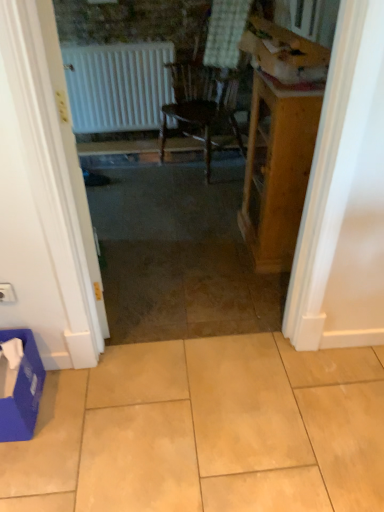
I want to click on white matte radiator at upper left, so click(118, 86).

The image size is (384, 512). What do you see at coordinates (44, 197) in the screenshot?
I see `white matte door at left` at bounding box center [44, 197].

Measure the distance between point (246, 219) and camera.

Point (246, 219) and camera are 2.53 meters apart from each other.

The height and width of the screenshot is (512, 384). What do you see at coordinates (284, 52) in the screenshot?
I see `cardboard box at upper right, the second cardboard box viewed from the left` at bounding box center [284, 52].

The width and height of the screenshot is (384, 512). Identify the location of white plastic electric outlet at lower left. (7, 293).

Can you confirm if white matte radiator at upper left is smaller than beige ceramic tile at center?

Result: Correct, white matte radiator at upper left occupies less space than beige ceramic tile at center.

Can you see white matte radiator at upper left touching beige ceramic tile at center?

white matte radiator at upper left and beige ceramic tile at center are clearly separated.

Based on the photo, does white matte radiator at upper left turn towards beige ceramic tile at center?

Yes, white matte radiator at upper left is facing beige ceramic tile at center.

This screenshot has width=384, height=512. Find the location of `ceramic tile on the right of the white matte radiator at upper left`. ceramic tile on the right of the white matte radiator at upper left is located at coordinates (206, 430).

Which is correct: white matte radiator at upper left is inside white matte door at left, or outside of it?

white matte radiator at upper left cannot be found inside white matte door at left.

From the image's perspective, which is below, white matte radiator at upper left or white matte door at left?

white matte door at left is shown below in the image.

Measure the distance from white matte radiator at upper left to white matte door at left.

white matte radiator at upper left and white matte door at left are 1.95 meters apart.

Considering the relative sizes of white matte radiator at upper left and white matte door at left in the image provided, is white matte radiator at upper left taller than white matte door at left?

No, white matte radiator at upper left is not taller than white matte door at left.

Where is `door that appears in front of the wooden table at right`? The height and width of the screenshot is (512, 384). door that appears in front of the wooden table at right is located at coordinates (44, 197).

Could you tell me if white matte door at left is facing wooden table at right?

Yes.

In the scene shown: Who is bigger, white matte door at left or wooden table at right?

With larger size is wooden table at right.

In the scene shown: Are white matte radiator at upper left and blue cardboard box at lower left, which ranks as the second cardboard box in right-to-left order, located far from each other?

white matte radiator at upper left is far away from blue cardboard box at lower left, which ranks as the second cardboard box in right-to-left order.

In the scene shown: From a real-world perspective, who is located higher, white matte radiator at upper left or blue cardboard box at lower left, which appears as the 1th cardboard box when viewed from the left?

white matte radiator at upper left.

In the image, is white matte radiator at upper left on the left side or the right side of blue cardboard box at lower left, which is counted as the first cardboard box, starting from the bottom?

From the image, it's evident that white matte radiator at upper left is to the right of blue cardboard box at lower left, which is counted as the first cardboard box, starting from the bottom.

Measure the distance from white matte radiator at upper left to blue cardboard box at lower left, which appears as the 1th cardboard box when viewed from the left.

The distance of white matte radiator at upper left from blue cardboard box at lower left, which appears as the 1th cardboard box when viewed from the left, is 2.30 meters.

Between wooden table at right and white matte door at left, which one has less height?

wooden table at right is shorter.

From a real-world perspective, between wooden table at right and white matte door at left, who is vertically higher?

white matte door at left is physically above.

Looking at this image, from the image's perspective, relative to white matte door at left, is wooden table at right above or below?

wooden table at right is situated higher than white matte door at left in the image.

Which object is closer to the camera, wooden table at right or white matte door at left?

white matte door at left is in front.

Can you confirm if white plastic electric outlet at lower left is thinner than white matte radiator at upper left?

Correct, the width of white plastic electric outlet at lower left is less than that of white matte radiator at upper left.

What are the coordinates of `electric outlet lying on the left of white matte radiator at upper left` in the screenshot? It's located at (7, 293).

Does point (1, 298) come behind point (117, 48)?

No, (1, 298) is closer to viewer.

Which object is closer to the camera taking this photo, white plastic electric outlet at lower left or white matte radiator at upper left?

white plastic electric outlet at lower left.

Who is more distant, beige ceramic tile at center or cardboard box at upper right, the second cardboard box viewed from the left?

cardboard box at upper right, the second cardboard box viewed from the left, is further from the camera.

Starting from the beige ceramic tile at center, which cardboard box is the 2nd one behind? Please provide its 2D coordinates.

[(284, 52)]

Can you confirm if beige ceramic tile at center is positioned to the left of cardboard box at upper right, the second cardboard box ordered from the bottom?

Correct, you'll find beige ceramic tile at center to the left of cardboard box at upper right, the second cardboard box ordered from the bottom.

The image size is (384, 512). I want to click on ceramic tile below the white matte radiator at upper left (from a real-world perspective), so click(x=206, y=430).

At what (x,y) coordinates should I click in order to perform the action: click on radiator above the white matte door at left (from the image's perspective). Please return your answer as a coordinate pair (x, y). This screenshot has width=384, height=512. Looking at the image, I should click on (118, 86).

Based on their spatial positions, is white plastic electric outlet at lower left or beige ceramic tile at center further from blue cardboard box at lower left, which is the 2th cardboard box in top-to-bottom order?

beige ceramic tile at center is positioned further to the anchor blue cardboard box at lower left, which is the 2th cardboard box in top-to-bottom order.

Estimate the real-world distances between objects in this image. Which object is closer to beige ceramic tile at center, wooden table at right or cardboard box at upper right, the first cardboard box in the right-to-left sequence?

wooden table at right is closer to beige ceramic tile at center.

Estimate the real-world distances between objects in this image. Which object is further from white matte radiator at upper left, white matte door at left or cardboard box at upper right, the second cardboard box ordered from the bottom?

white matte door at left lies further to white matte radiator at upper left than the other object.

Consider the image. When comparing their distances from cardboard box at upper right, positioned as the first cardboard box in top-to-bottom order, does white matte door at left or beige ceramic tile at center seem closer?

white matte door at left lies closer to cardboard box at upper right, positioned as the first cardboard box in top-to-bottom order, than the other object.

Estimate the real-world distances between objects in this image. Which object is closer to white matte radiator at upper left, white plastic electric outlet at lower left or white matte door at left?

Among the two, white matte door at left is located nearer to white matte radiator at upper left.

From the image, which object appears to be nearer to white plastic electric outlet at lower left, beige ceramic tile at center or white matte radiator at upper left?

beige ceramic tile at center is positioned closer to the anchor white plastic electric outlet at lower left.

Based on their spatial positions, is cardboard box at upper right, the second cardboard box ordered from the bottom, or wooden table at right further from white plastic electric outlet at lower left?

Based on the image, cardboard box at upper right, the second cardboard box ordered from the bottom, appears to be further to white plastic electric outlet at lower left.

Based on their spatial positions, is wooden table at right or white plastic electric outlet at lower left closer to white matte door at left?

white plastic electric outlet at lower left.

At what (x,y) coordinates should I click in order to perform the action: click on table between white matte radiator at upper left and beige ceramic tile at center in the vertical direction. Please return your answer as a coordinate pair (x, y). The width and height of the screenshot is (384, 512). Looking at the image, I should click on (277, 168).

At what (x,y) coordinates should I click in order to perform the action: click on ceramic tile positioned between white matte door at left and white matte radiator at upper left from near to far. Please return your answer as a coordinate pair (x, y). Image resolution: width=384 pixels, height=512 pixels. Looking at the image, I should click on (206, 430).

Identify the location of cardboard box between white plastic electric outlet at lower left and white matte radiator at upper left along the z-axis. (284, 52).

This screenshot has width=384, height=512. I want to click on ceramic tile situated between white plastic electric outlet at lower left and wooden table at right from left to right, so click(206, 430).